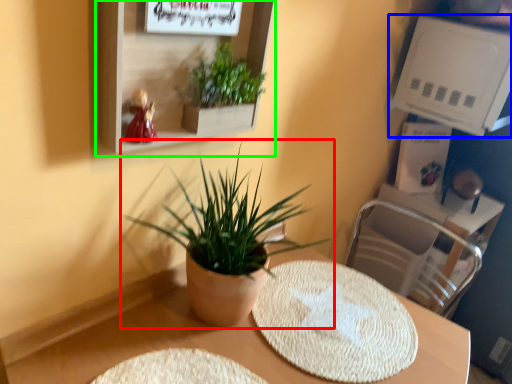
Question: Which object is positioned closest to houseplant (highlighted by a red box)? Select from shelf (highlighted by a blue box) and shelf (highlighted by a green box).

Choices:
 (A) shelf
 (B) shelf

Answer: (B)